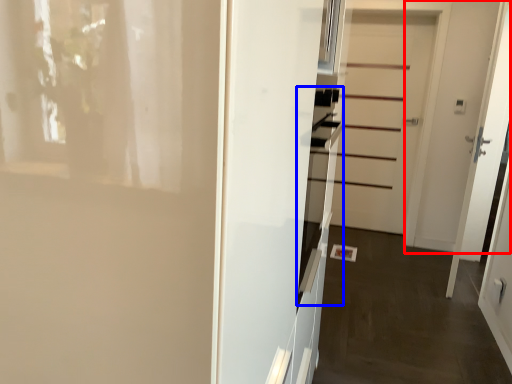
Question: Among these objects, which one is nearest to the camera, door (highlighted by a red box) or oven (highlighted by a blue box)?

Choices:
 (A) door
 (B) oven

Answer: (B)